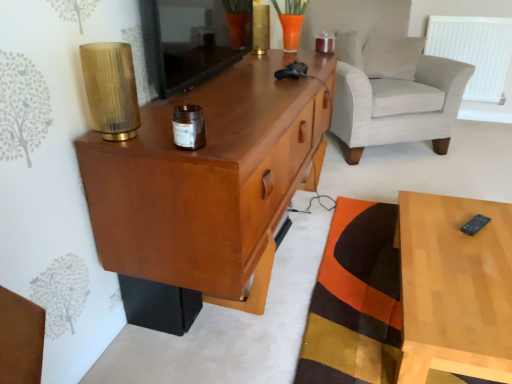
At what (x,y) coordinates should I click in order to perform the action: click on vacant space that is to the left of brown glass jar at center, which is counted as the 2th candle holder, starting from the back. Please return your answer as a coordinate pair (x, y). Image resolution: width=512 pixels, height=384 pixels. Looking at the image, I should click on (143, 139).